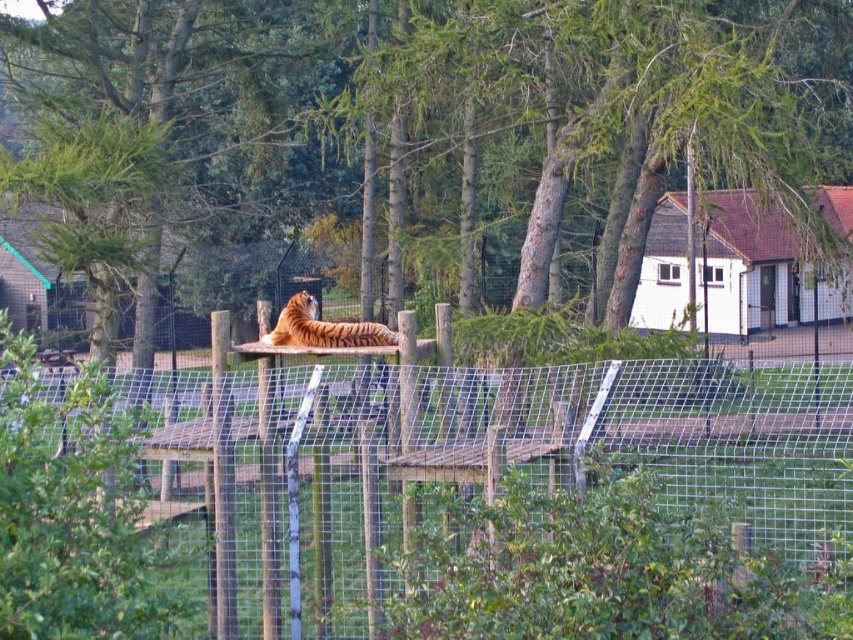
Question: Estimate the real-world distances between objects in this image. Which object is closer to the orange striped tiger at center?

Choices:
 (A) green leafy tree at center
 (B) metallic wire mesh at center

Answer: (B)

Question: Is metallic wire mesh at center in front of green leafy tree at center?

Choices:
 (A) no
 (B) yes

Answer: (B)

Question: Is metallic wire mesh at center behind green leafy tree at center?

Choices:
 (A) no
 (B) yes

Answer: (A)

Question: Can you confirm if metallic wire mesh at center is wider than orange striped tiger at center?

Choices:
 (A) yes
 (B) no

Answer: (A)

Question: Which is nearer to the metallic wire mesh at center?

Choices:
 (A) green leafy tree at center
 (B) orange striped tiger at center

Answer: (B)

Question: Based on their relative distances, which object is farther from the metallic wire mesh at center?

Choices:
 (A) orange striped tiger at center
 (B) green leafy tree at center

Answer: (B)